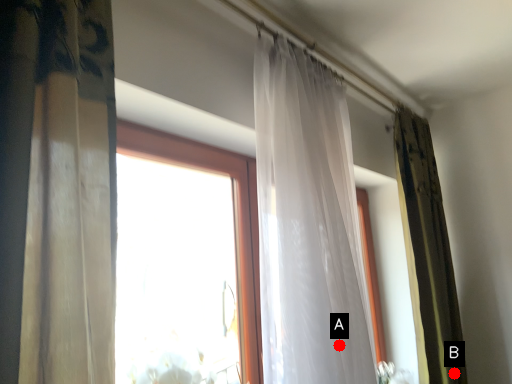
Question: Two points are circled on the image, labeled by A and B beside each circle. Which of the following is the farthest from the observer?

Choices:
 (A) A is further
 (B) B is further

Answer: (B)